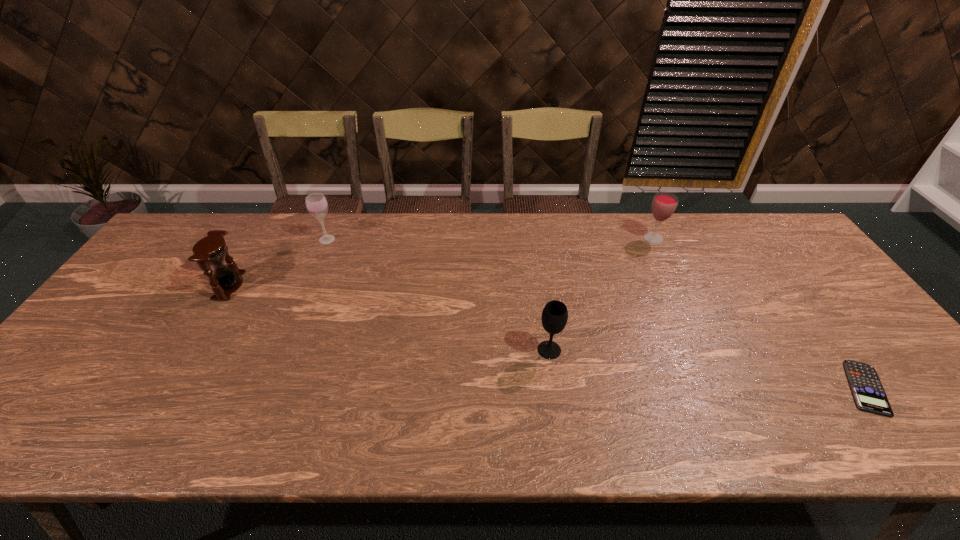
At what (x,y) coordinates should I click in order to perform the action: click on free location located 0.150m on the right of the hourglass. Please return your answer as a coordinate pair (x, y). The width and height of the screenshot is (960, 540). Looking at the image, I should click on (295, 286).

Image resolution: width=960 pixels, height=540 pixels. Identify the location of vacant space located on the right of the third object from left to right. (670, 350).

Identify the location of vacant position located 0.370m on the back of the rightmost object. (772, 261).

I want to click on object located in the near edge section of the desktop, so click(x=869, y=394).

Where is `object at the right edge`? The height and width of the screenshot is (540, 960). object at the right edge is located at coordinates (869, 394).

Locate an element on the screen. The height and width of the screenshot is (540, 960). object located in the near right corner section of the desktop is located at coordinates (869, 394).

This screenshot has width=960, height=540. Find the location of `blank area at the far edge`. blank area at the far edge is located at coordinates (499, 243).

Where is `vacant space at the near edge of the desktop`? The height and width of the screenshot is (540, 960). vacant space at the near edge of the desktop is located at coordinates (346, 413).

Image resolution: width=960 pixels, height=540 pixels. In order to click on vacant region at the left edge of the desktop in this screenshot , I will do `click(122, 342)`.

What are the coordinates of `vacant space at the right edge` in the screenshot? It's located at (759, 262).